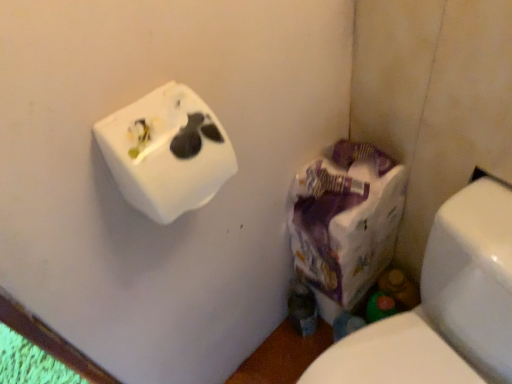
You are a GUI agent. You are given a task and a screenshot of the screen. Output one action in this format:
    pyautogui.click(x=<x>, y=<y>)
    Task: Click on the white glossy toilet at lower right
    This screenshot has height=384, width=512.
    Given the screenshot: What is the action you would take?
    pyautogui.click(x=443, y=306)

Locate an element on the screen. The image size is (512, 384). toilet beneath the purple paper bag at lower right (from a real-world perspective) is located at coordinates (443, 306).

Can you tell me how much white glossy toilet at lower right and purple paper bag at lower right differ in facing direction?

The angular difference between white glossy toilet at lower right and purple paper bag at lower right is 7.08 degrees.

Between white glossy toilet at lower right and purple paper bag at lower right, which one has more height?

Standing taller between the two is white glossy toilet at lower right.

Does white glossy toilet at lower right have a larger size compared to purple paper bag at lower right?

Correct, white glossy toilet at lower right is larger in size than purple paper bag at lower right.

From a real-world perspective, does white glossy toilet at lower right stand above white matte tissue box at upper left?

No, from a real-world perspective, white glossy toilet at lower right is not above white matte tissue box at upper left.

Identify the location of toilet paper to the left of white glossy toilet at lower right. This screenshot has width=512, height=384. (166, 152).

Based on their positions, is white glossy toilet at lower right located to the left or right of white matte tissue box at upper left?

white glossy toilet at lower right is to the right of white matte tissue box at upper left.

Which object is positioned more to the left, purple paper bag at lower right or white glossy toilet at lower right?

From the viewer's perspective, purple paper bag at lower right appears more on the left side.

Looking at this image, who is smaller, purple paper bag at lower right or white glossy toilet at lower right?

With smaller size is purple paper bag at lower right.

Looking at this image, considering the relative sizes of purple paper bag at lower right and white glossy toilet at lower right in the image provided, is purple paper bag at lower right shorter than white glossy toilet at lower right?

Indeed, purple paper bag at lower right has a lesser height compared to white glossy toilet at lower right.

Which point is more distant from viewer, [334,160] or [484,322]?

The point [334,160] is farther.

Which is correct: white matte tissue box at upper left is inside purple paper bag at lower right, or outside of it?

white matte tissue box at upper left is located beyond the bounds of purple paper bag at lower right.

Considering the sizes of objects white matte tissue box at upper left and purple paper bag at lower right in the image provided, who is wider, white matte tissue box at upper left or purple paper bag at lower right?

With larger width is purple paper bag at lower right.

From a real-world perspective, is white matte tissue box at upper left physically below purple paper bag at lower right?

No, from a real-world perspective, white matte tissue box at upper left is not below purple paper bag at lower right.

In the scene shown: Which is less distant, (139, 139) or (356, 198)?

Clearly, point (139, 139) is closer to the camera than point (356, 198).

Considering the sizes of objects white matte tissue box at upper left and white glossy toilet at lower right in the image provided, who is thinner, white matte tissue box at upper left or white glossy toilet at lower right?

Thinner between the two is white matte tissue box at upper left.

Measure the distance from white matte tissue box at upper left to white glossy toilet at lower right.

They are 20.98 inches apart.

From a real-world perspective, is white matte tissue box at upper left on top of white glossy toilet at lower right?

Yes, from a real-world perspective, white matte tissue box at upper left is above white glossy toilet at lower right.

Can you confirm if white matte tissue box at upper left is positioned to the right of white glossy toilet at lower right?

Incorrect, white matte tissue box at upper left is not on the right side of white glossy toilet at lower right.

Locate an element on the screen. paper bag that is under the white matte tissue box at upper left (from a real-world perspective) is located at coordinates (346, 220).

Considering the relative positions of purple paper bag at lower right and white matte tissue box at upper left in the image provided, is purple paper bag at lower right behind white matte tissue box at upper left?

Yes, it is.

I want to click on paper bag above the white glossy toilet at lower right (from a real-world perspective), so click(346, 220).

In order to click on toilet on the right of white matte tissue box at upper left in this screenshot , I will do `click(443, 306)`.

Looking at the image, which one is located closer to white matte tissue box at upper left, white glossy toilet at lower right or purple paper bag at lower right?

purple paper bag at lower right is closer to white matte tissue box at upper left.

Estimate the real-world distances between objects in this image. Which object is further from purple paper bag at lower right, white glossy toilet at lower right or white matte tissue box at upper left?

white matte tissue box at upper left is further to purple paper bag at lower right.

From the image, which object appears to be nearer to white matte tissue box at upper left, purple paper bag at lower right or white glossy toilet at lower right?

purple paper bag at lower right is closer to white matte tissue box at upper left.

Estimate the real-world distances between objects in this image. Which object is further from white glossy toilet at lower right, white matte tissue box at upper left or purple paper bag at lower right?

white matte tissue box at upper left lies further to white glossy toilet at lower right than the other object.

Which object lies further to the anchor point purple paper bag at lower right, white matte tissue box at upper left or white glossy toilet at lower right?

Based on the image, white matte tissue box at upper left appears to be further to purple paper bag at lower right.

Which object lies nearer to the anchor point white glossy toilet at lower right, purple paper bag at lower right or white matte tissue box at upper left?

Among the two, purple paper bag at lower right is located nearer to white glossy toilet at lower right.

The height and width of the screenshot is (384, 512). Identify the location of paper bag between white matte tissue box at upper left and white glossy toilet at lower right vertically. (346, 220).